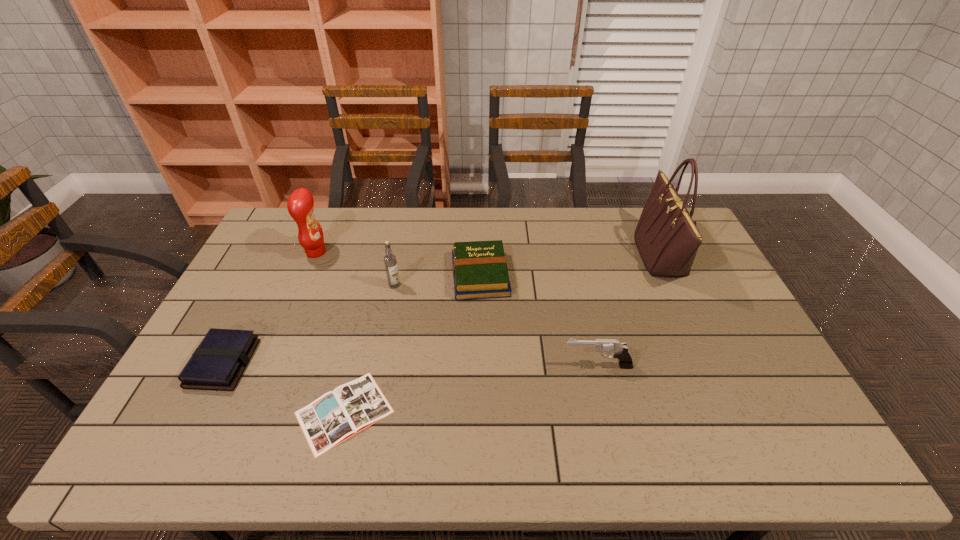
Where is `vacant area located 0.250m at the muzzle of the gun`? vacant area located 0.250m at the muzzle of the gun is located at coordinates (471, 366).

You are a GUI agent. You are given a task and a screenshot of the screen. Output one action in this format:
    pyautogui.click(x=<x>, y=<y>)
    Task: Click on the free region located on the front of the rightmost book
    The width and height of the screenshot is (960, 540).
    Given the screenshot: What is the action you would take?
    pyautogui.click(x=480, y=417)

Image resolution: width=960 pixels, height=540 pixels. I want to click on blank area located on the back of the second shortest object, so click(279, 255).

You are a GUI agent. You are given a task and a screenshot of the screen. Output one action in this format:
    pyautogui.click(x=<x>, y=<y>)
    Task: Click on the vacant space located 0.160m on the left of the second book from left to right
    This screenshot has width=960, height=540.
    Given the screenshot: What is the action you would take?
    pyautogui.click(x=230, y=412)

Find the location of a particular element. The height and width of the screenshot is (540, 960). handbag at the far edge is located at coordinates (667, 238).

This screenshot has width=960, height=540. In order to click on condiment situated at the far edge in this screenshot , I will do click(300, 205).

At what (x,y) coordinates should I click in order to perform the action: click on object at the near edge. Please return your answer as a coordinate pair (x, y). The width and height of the screenshot is (960, 540). Looking at the image, I should click on (337, 415).

Identify the location of object that is at the left edge. This screenshot has height=540, width=960. (219, 361).

Locate an element on the screen. object present at the right edge is located at coordinates (667, 238).

You are a GUI agent. You are given a task and a screenshot of the screen. Output one action in this format:
    pyautogui.click(x=<x>, y=<y>)
    Task: Click on the object located in the far right corner section of the desktop
    This screenshot has width=960, height=540.
    Given the screenshot: What is the action you would take?
    pyautogui.click(x=667, y=238)